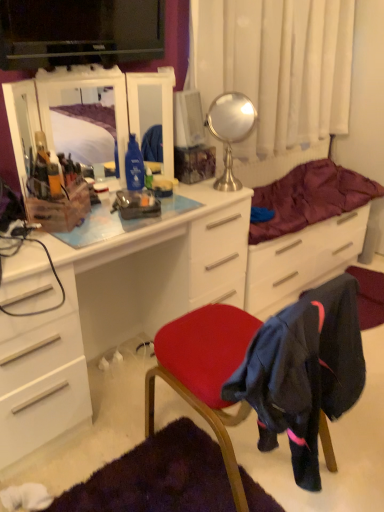
Question: Is point (67, 79) closer or farther from the camera than point (301, 179)?

Choices:
 (A) farther
 (B) closer

Answer: (B)

Question: In terms of size, does matte plastic mirror at upper left, the 2th mirror viewed from the right, appear bigger or smaller than maroon quilted blanket at center?

Choices:
 (A) small
 (B) big

Answer: (A)

Question: Estimate the real-world distances between objects in this image. Which object is closer to the polished silver mirror at upper center, the second mirror viewed from the left?

Choices:
 (A) velvet red chair at center
 (B) maroon quilted blanket at center
 (C) white sheer curtain at upper center
 (D) white glossy chest of drawers at center
 (E) matte plastic mirror at upper left, which is the 1th mirror in left-to-right order

Answer: (C)

Question: Estimate the real-world distances between objects in this image. Which object is closer to the maroon quilted blanket at center?

Choices:
 (A) white sheer curtain at upper center
 (B) velvet red chair at center
 (C) matte plastic mirror at upper left, which is the 1th mirror in left-to-right order
 (D) polished silver mirror at upper center, placed as the 1th mirror when sorted from right to left
 (E) white glossy chest of drawers at center

Answer: (D)